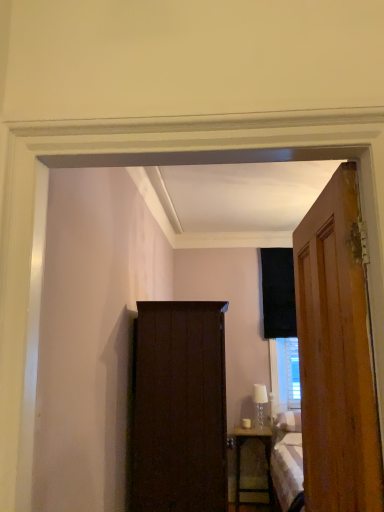
Question: Can you confirm if white glass lamp at center is shorter than dark wood cabinet at center?

Choices:
 (A) no
 (B) yes

Answer: (B)

Question: Is dark wood cabinet at center surrounded by white glass lamp at center?

Choices:
 (A) no
 (B) yes

Answer: (A)

Question: Is white glass lamp at center bigger than dark wood cabinet at center?

Choices:
 (A) no
 (B) yes

Answer: (A)

Question: Is white glass lamp at center not inside dark wood cabinet at center?

Choices:
 (A) yes
 (B) no

Answer: (A)

Question: Would you consider white glass lamp at center to be distant from dark wood cabinet at center?

Choices:
 (A) no
 (B) yes

Answer: (B)

Question: Considering the positions of point (259, 387) and point (170, 438), is point (259, 387) closer or farther from the camera than point (170, 438)?

Choices:
 (A) farther
 (B) closer

Answer: (A)

Question: Would you say white glass lamp at center is inside or outside dark wood cabinet at center?

Choices:
 (A) inside
 (B) outside

Answer: (B)

Question: Considering the positions of white glass lamp at center and dark wood cabinet at center in the image, is white glass lamp at center taller or shorter than dark wood cabinet at center?

Choices:
 (A) short
 (B) tall

Answer: (A)

Question: Relative to dark wood cabinet at center, is white glass lamp at center in front or behind?

Choices:
 (A) behind
 (B) front

Answer: (A)

Question: From the image's perspective, is dark wood cabinet at center located above or below wooden nightstand at lower right?

Choices:
 (A) below
 (B) above

Answer: (B)

Question: From a real-world perspective, relative to wooden nightstand at lower right, is dark wood cabinet at center vertically above or below?

Choices:
 (A) below
 (B) above

Answer: (B)

Question: Is dark wood cabinet at center taller or shorter than wooden nightstand at lower right?

Choices:
 (A) short
 (B) tall

Answer: (B)

Question: Considering the positions of point (140, 498) and point (241, 434), is point (140, 498) closer or farther from the camera than point (241, 434)?

Choices:
 (A) closer
 (B) farther

Answer: (A)

Question: From a real-world perspective, is wooden door at right physically located above or below wooden nightstand at lower right?

Choices:
 (A) below
 (B) above

Answer: (B)

Question: Considering their positions, is wooden door at right located in front of or behind wooden nightstand at lower right?

Choices:
 (A) behind
 (B) front

Answer: (B)